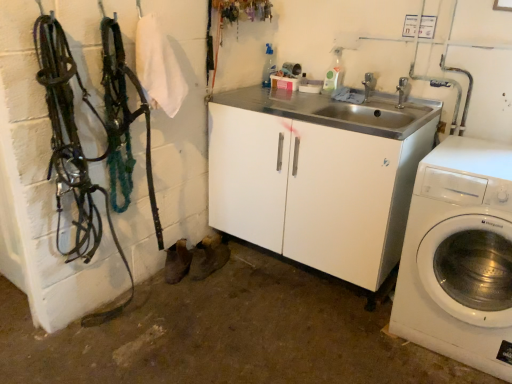
Question: From the image's perspective, is silver metallic faucet at upper center, acting as the second faucet starting from the left, above or below white plastic washing machine at right?

Choices:
 (A) below
 (B) above

Answer: (B)

Question: In the image, is silver metallic faucet at upper center, the second faucet in the back-to-front sequence, positioned in front of or behind white plastic washing machine at right?

Choices:
 (A) behind
 (B) front

Answer: (A)

Question: Which object is the closest to the silver metallic faucet at upper center, positioned as the 2th faucet in right-to-left order?

Choices:
 (A) white plastic washing machine at right
 (B) silver metallic faucet at upper center, acting as the second faucet starting from the left

Answer: (B)

Question: Which object is positioned farthest from the silver metallic faucet at upper center, the 1th faucet when ordered from right to left?

Choices:
 (A) white plastic washing machine at right
 (B) silver metallic faucet at upper center, positioned as the 2th faucet in right-to-left order

Answer: (A)